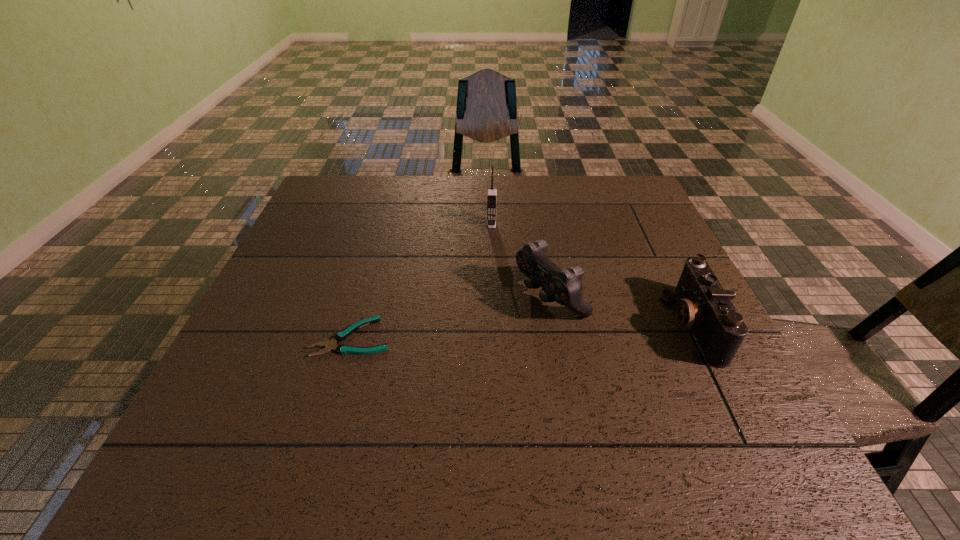
This screenshot has width=960, height=540. I want to click on the leftmost object, so click(x=340, y=336).

Locate an element on the screen. Image resolution: width=960 pixels, height=540 pixels. the shortest object is located at coordinates (340, 336).

Find the location of a particular element. This screenshot has height=540, width=960. the rightmost object is located at coordinates (704, 305).

Where is `the third object from left to right`? The width and height of the screenshot is (960, 540). the third object from left to right is located at coordinates (564, 286).

Locate an element on the screen. the tallest object is located at coordinates (491, 192).

Locate an element on the screen. the farthest object is located at coordinates 491,192.

The height and width of the screenshot is (540, 960). Find the location of `free space located 0.090m on the back of the leftmost object`. free space located 0.090m on the back of the leftmost object is located at coordinates (365, 291).

I want to click on vacant space located 0.130m on the front-facing side of the camera, so click(x=612, y=325).

This screenshot has width=960, height=540. In order to click on free space located on the front-facing side of the camera in this screenshot , I will do `click(572, 325)`.

This screenshot has width=960, height=540. I want to click on free space located on the front-facing side of the camera, so click(492, 325).